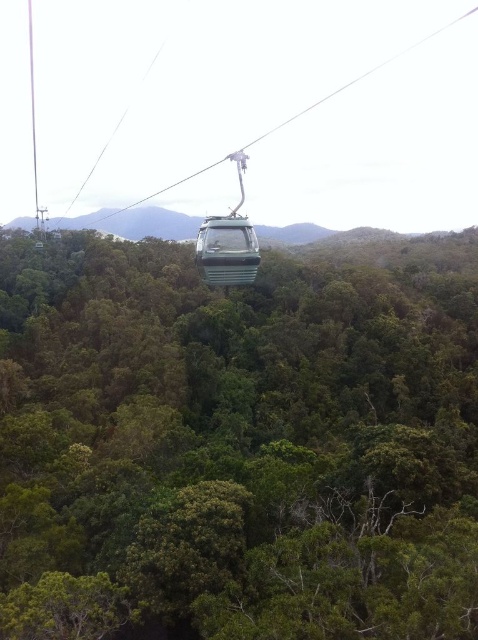
Question: Can you confirm if green leafy tree at center is wider than metallic green cable car at center?

Choices:
 (A) yes
 (B) no

Answer: (A)

Question: Can you confirm if green leafy tree at center is positioned above metallic green cable car at center?

Choices:
 (A) yes
 (B) no

Answer: (A)

Question: Can you confirm if green leafy tree at center is positioned to the right of metallic green cable car at center?

Choices:
 (A) yes
 (B) no

Answer: (B)

Question: Among these points, which one is nearest to the camera?

Choices:
 (A) (387, 538)
 (B) (29, 32)

Answer: (A)

Question: Which object is closer to the camera taking this photo?

Choices:
 (A) metallic green gondola at center
 (B) green leafy tree at center
 (C) metallic green cable car at center

Answer: (B)

Question: Estimate the real-world distances between objects in this image. Which object is closer to the metallic green gondola at center?

Choices:
 (A) metallic green cable car at center
 (B) green leafy tree at center

Answer: (B)